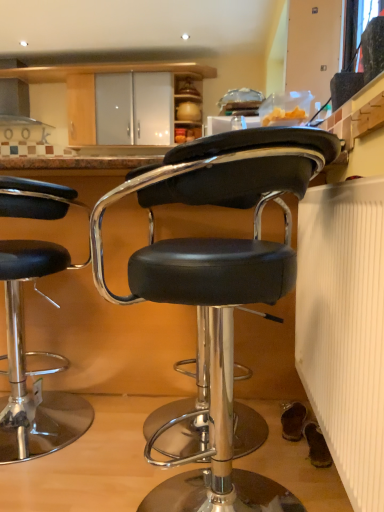
Question: Is transparent glass window screen at upper right behind black leather stool at center, the second chair positioned from the left?

Choices:
 (A) yes
 (B) no

Answer: (A)

Question: Does transparent glass window screen at upper right touch black leather stool at center, the second chair positioned from the left?

Choices:
 (A) yes
 (B) no

Answer: (B)

Question: Is transparent glass window screen at upper right aimed at black leather stool at center, placed as the 2th chair when sorted from back to front?

Choices:
 (A) yes
 (B) no

Answer: (B)

Question: From a real-world perspective, is transparent glass window screen at upper right over black leather stool at center, placed as the 2th chair when sorted from back to front?

Choices:
 (A) no
 (B) yes

Answer: (B)

Question: From a real-world perspective, is transparent glass window screen at upper right below black leather stool at center, placed as the 2th chair when sorted from back to front?

Choices:
 (A) yes
 (B) no

Answer: (B)

Question: From the image's perspective, is transparent glass window screen at upper right located above or below black leather stool at left, which appears as the 1th chair when viewed from the back?

Choices:
 (A) below
 (B) above

Answer: (B)

Question: Looking at their shapes, would you say transparent glass window screen at upper right is wider or thinner than black leather stool at left, which ranks as the second chair in right-to-left order?

Choices:
 (A) thin
 (B) wide

Answer: (A)

Question: Is point (352, 34) closer or farther from the camera than point (61, 185)?

Choices:
 (A) closer
 (B) farther

Answer: (B)

Question: Is transparent glass window screen at upper right to the left or to the right of black leather stool at left, which ranks as the 2th chair in front-to-back order, in the image?

Choices:
 (A) right
 (B) left

Answer: (A)

Question: In terms of width, does white ribbed radiator at lower right look wider or thinner when compared to black leather stool at center, placed as the 2th chair when sorted from back to front?

Choices:
 (A) wide
 (B) thin

Answer: (B)

Question: From the image's perspective, is white ribbed radiator at lower right located above or below black leather stool at center, placed as the 2th chair when sorted from back to front?

Choices:
 (A) below
 (B) above

Answer: (B)

Question: From a real-world perspective, is white ribbed radiator at lower right above or below black leather stool at center, placed as the 2th chair when sorted from back to front?

Choices:
 (A) below
 (B) above

Answer: (B)

Question: Based on their sizes in the image, would you say white ribbed radiator at lower right is bigger or smaller than black leather stool at center, placed as the 2th chair when sorted from back to front?

Choices:
 (A) small
 (B) big

Answer: (A)

Question: Relative to white ribbed radiator at lower right, is black leather stool at center, the 1th chair from the front, in front or behind?

Choices:
 (A) behind
 (B) front

Answer: (A)

Question: From the image's perspective, is black leather stool at center, the second chair positioned from the left, above or below white ribbed radiator at lower right?

Choices:
 (A) above
 (B) below

Answer: (B)